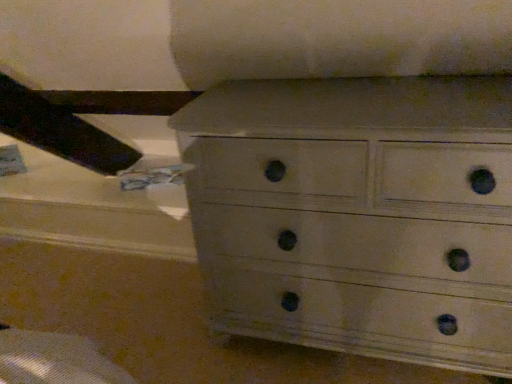
Image resolution: width=512 pixels, height=384 pixels. What do you see at coordinates (358, 214) in the screenshot?
I see `white painted wood chest of drawers at center` at bounding box center [358, 214].

Measure the distance between white painted wood chest of drawers at center and camera.

They are 32.99 inches apart.

Where is `white painted wood chest of drawers at center`? The image size is (512, 384). white painted wood chest of drawers at center is located at coordinates (358, 214).

Find the location of a particular element. The image size is (512, 384). white painted wood chest of drawers at center is located at coordinates (358, 214).